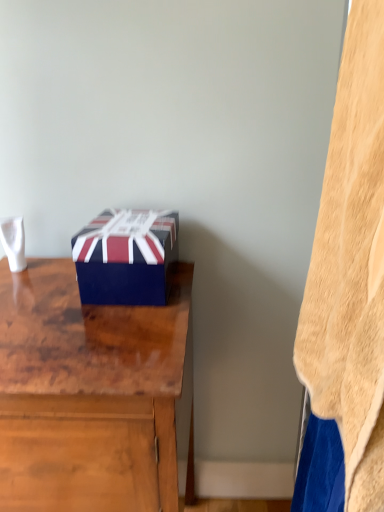
Find the location of `free space to the left of blue glossy box at center`. free space to the left of blue glossy box at center is located at coordinates (41, 285).